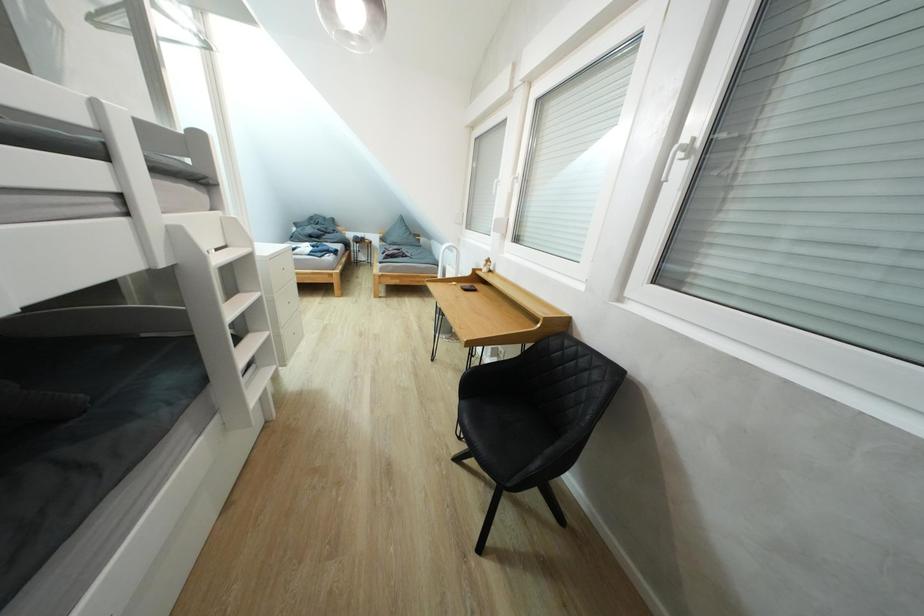
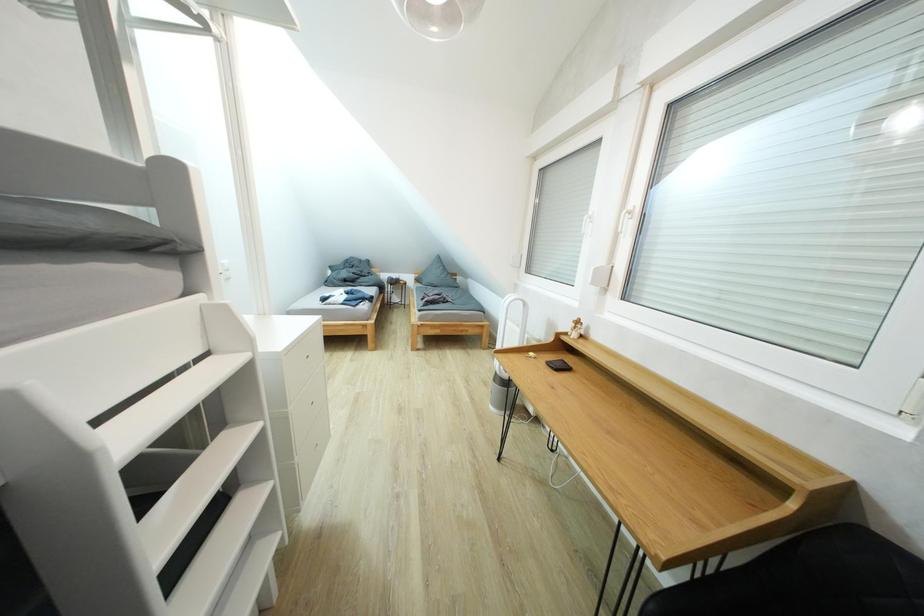
Question: The first image is from the beginning of the video and the second image is from the end. How did the camera likely rotate when shooting the video?

Choices:
 (A) Left
 (B) Right
 (C) Up
 (D) Down

Answer: (C)